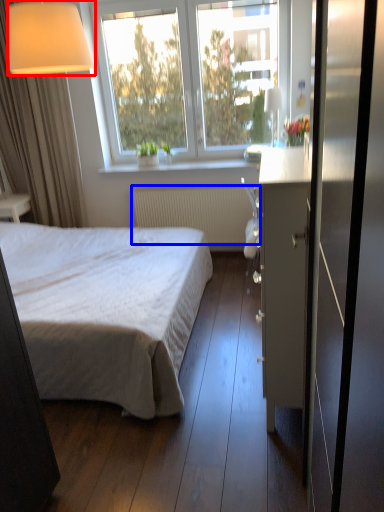
Question: Which of the following is the closest to the observer, lamp (highlighted by a red box) or radiator (highlighted by a blue box)?

Choices:
 (A) lamp
 (B) radiator

Answer: (A)